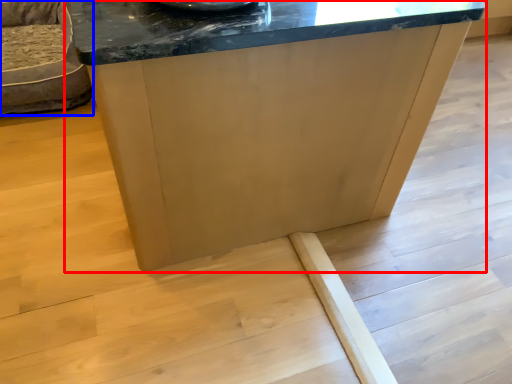
Question: Among these objects, which one is farthest to the camera, table (highlighted by a red box) or furniture (highlighted by a blue box)?

Choices:
 (A) table
 (B) furniture

Answer: (B)